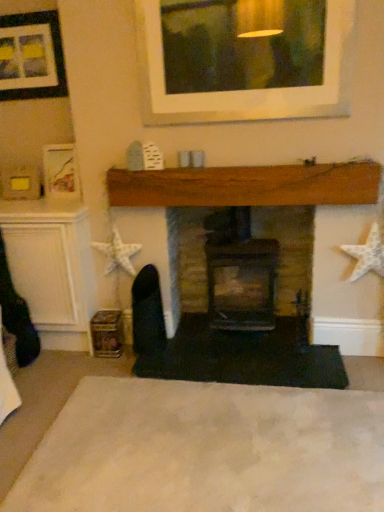
At what (x,y) coordinates should I click in order to perform the action: click on free space above white soft carpet at lower center (from a real-world perspective). Please return your answer as a coordinate pair (x, y). The width and height of the screenshot is (384, 512). Looking at the image, I should click on (210, 441).